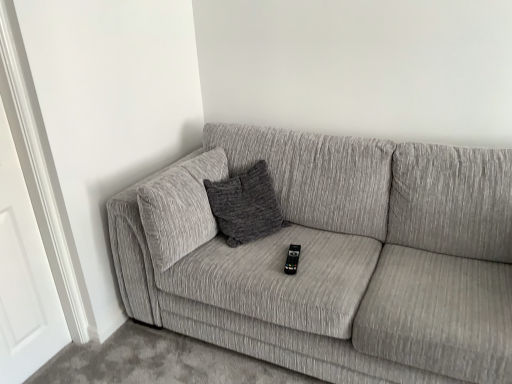
Question: Is textured gray couch at center not within white wood door at left?

Choices:
 (A) no
 (B) yes

Answer: (B)

Question: Is textured gray couch at center turned away from white wood door at left?

Choices:
 (A) no
 (B) yes

Answer: (A)

Question: Considering the relative sizes of textured gray couch at center and white wood door at left in the image provided, is textured gray couch at center bigger than white wood door at left?

Choices:
 (A) no
 (B) yes

Answer: (B)

Question: Would you say textured gray couch at center contains white wood door at left?

Choices:
 (A) yes
 (B) no

Answer: (B)

Question: Does textured gray couch at center appear on the right side of white wood door at left?

Choices:
 (A) no
 (B) yes

Answer: (B)

Question: Is white wood door at left situated inside textured gray couch at center or outside?

Choices:
 (A) inside
 (B) outside

Answer: (B)

Question: From their relative heights in the image, would you say white wood door at left is taller or shorter than textured gray couch at center?

Choices:
 (A) short
 (B) tall

Answer: (B)

Question: Is point (10, 309) positioned closer to the camera than point (453, 192)?

Choices:
 (A) closer
 (B) farther

Answer: (A)

Question: Based on their positions, is white wood door at left located to the left or right of textured gray couch at center?

Choices:
 (A) right
 (B) left

Answer: (B)

Question: Looking at the image, does black plastic remote at center seem bigger or smaller compared to white wood door at left?

Choices:
 (A) small
 (B) big

Answer: (A)

Question: Based on their positions, is black plastic remote at center located to the left or right of white wood door at left?

Choices:
 (A) right
 (B) left

Answer: (A)

Question: Looking at their shapes, would you say black plastic remote at center is wider or thinner than white wood door at left?

Choices:
 (A) thin
 (B) wide

Answer: (B)

Question: Is black plastic remote at center in front of or behind white wood door at left in the image?

Choices:
 (A) front
 (B) behind

Answer: (B)

Question: From the image's perspective, is black plastic remote at center located above or below textured gray couch at center?

Choices:
 (A) below
 (B) above

Answer: (A)

Question: In terms of height, does black plastic remote at center look taller or shorter compared to textured gray couch at center?

Choices:
 (A) short
 (B) tall

Answer: (A)